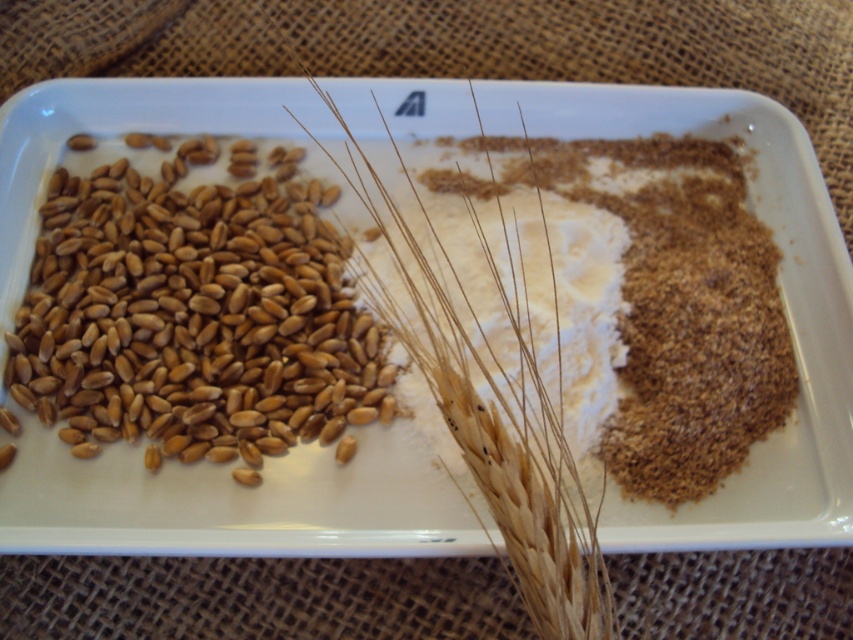
Question: Does golden matte wheat grains at left appear over metallic silver square at center?

Choices:
 (A) yes
 (B) no

Answer: (B)

Question: Which point is closer to the camera?

Choices:
 (A) brown matte barley at center
 (B) brown matte wheat at upper left

Answer: (A)

Question: Which point is closer to the camera taking this photo?

Choices:
 (A) (584, 429)
 (B) (193, 234)

Answer: (A)

Question: Among these points, which one is farthest from the camera?

Choices:
 (A) coord(322,276)
 (B) coord(398,106)
 (C) coord(213,547)

Answer: (B)

Question: Where is brown matte wheat at upper left located in relation to golden matte wheat grains at left in the image?

Choices:
 (A) below
 (B) above

Answer: (B)

Question: Is golden matte wheat grains at left below white powdery at center?

Choices:
 (A) yes
 (B) no

Answer: (A)